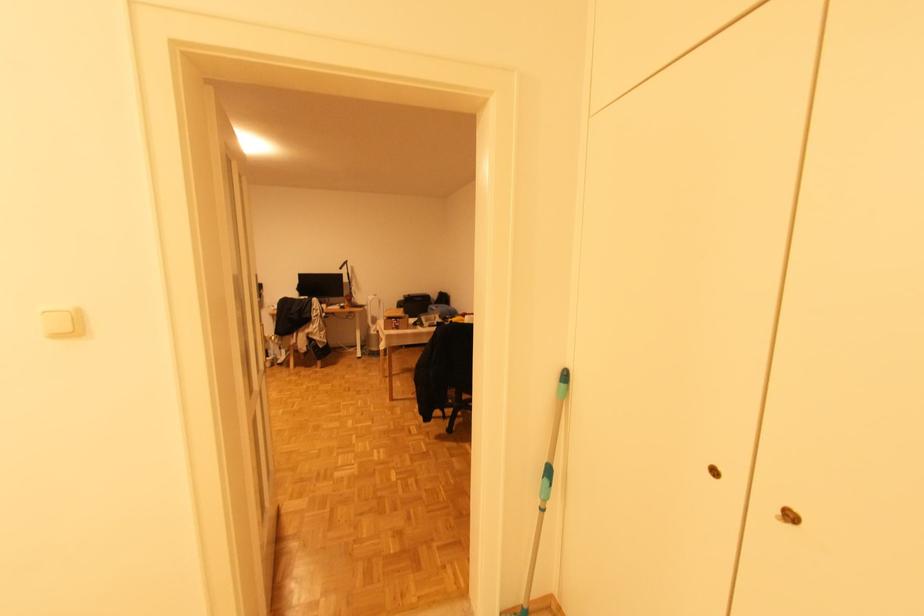
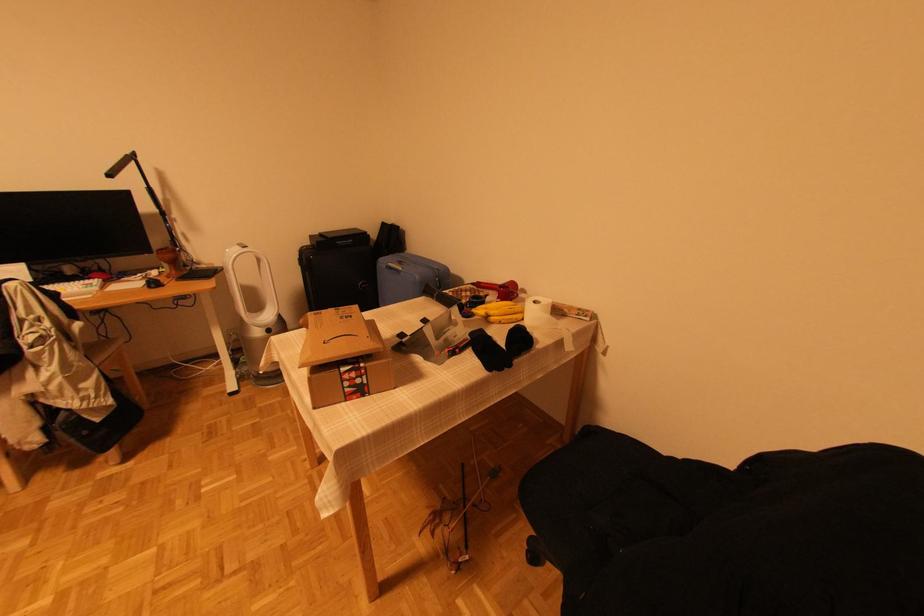
Question: In a continuous first-person perspective shot, in which direction is the camera moving?

Choices:
 (A) Left
 (B) Right
 (C) Forward
 (D) Backward

Answer: (C)